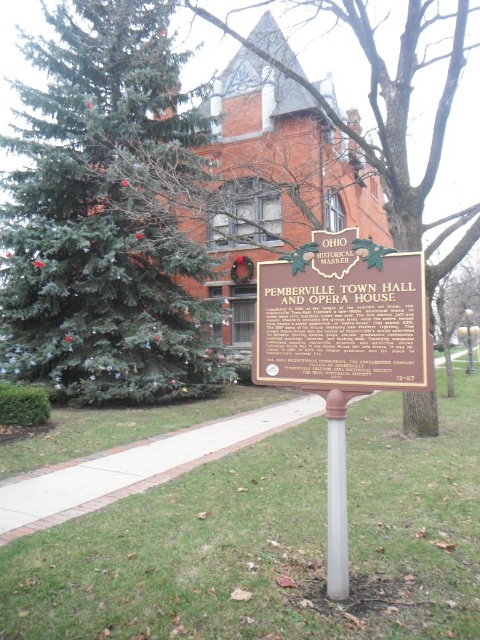
You are standing in front of the historical marker sign and want to take a photo of the brown polished wood sign at center without any obstructions. Is the green textured pine tree at left blocking your view of the sign?

The brown polished wood sign at center is behind the green textured pine tree at left, so the tree is blocking the view of the sign. To take a photo without obstruction, you would need to move around the tree or adjust your angle to see the sign beyond the tree.

You are a visitor standing in front of the Pemberville Town Hall and Opera House. You notice the green textured pine tree at left and the brown polished wood sign at center. Which object is located to the left of the other?

The green textured pine tree at left is positioned on the left side of brown polished wood sign at center.

You are standing at the center of the image and want to walk towards the green textured pine tree at left. In which direction should you move?

The green textured pine tree at left is located at point (105,216), which is to the left side of the image. Therefore, you should move towards the left direction to reach it.